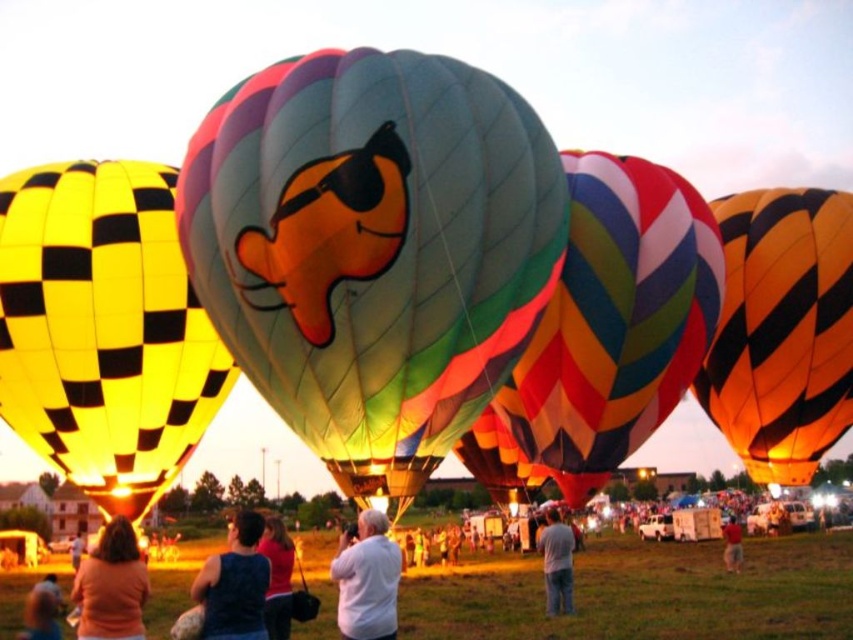
Does yellow checkered fabric hot air balloon at left appear over gray cotton shirt at center?

Correct, yellow checkered fabric hot air balloon at left is located above gray cotton shirt at center.

Who is shorter, yellow checkered fabric hot air balloon at left or gray cotton shirt at center?

gray cotton shirt at center is shorter.

This screenshot has height=640, width=853. I want to click on yellow checkered fabric hot air balloon at left, so click(103, 330).

Locate an element on the screen. The image size is (853, 640). yellow checkered fabric hot air balloon at left is located at coordinates (103, 330).

Is yellow checkered fabric hot air balloon at left positioned at the back of orange striped balloon at right?

No, yellow checkered fabric hot air balloon at left is closer to the viewer.

Is point (142, 227) positioned before point (822, 346)?

Yes, it is.

This screenshot has width=853, height=640. Find the location of `yellow checkered fabric hot air balloon at left`. yellow checkered fabric hot air balloon at left is located at coordinates (103, 330).

Is blue sleeveless shirt at lower left positioned before gray cotton shirt at center?

Yes, it is.

Who is taller, blue sleeveless shirt at lower left or gray cotton shirt at center?

With more height is blue sleeveless shirt at lower left.

Where is `blue sleeveless shirt at lower left`? blue sleeveless shirt at lower left is located at coordinates (234, 582).

Where is `blue sleeveless shirt at lower left`? blue sleeveless shirt at lower left is located at coordinates pyautogui.click(x=234, y=582).